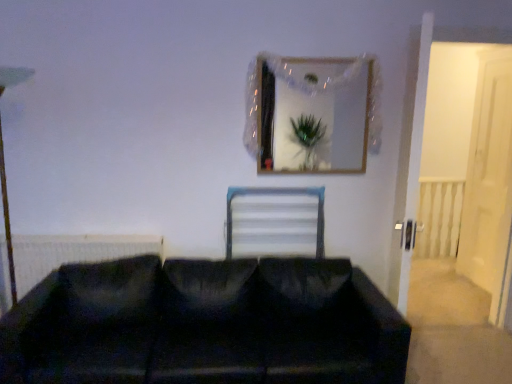
You are a GUI agent. You are given a task and a screenshot of the screen. Output one action in this format:
    pyautogui.click(x=<x>, y=<y>)
    Task: Click on the free space above wooden frame at upper center (from a real-world perspective)
    Image resolution: width=512 pixels, height=384 pixels.
    Given the screenshot: What is the action you would take?
    pyautogui.click(x=310, y=50)